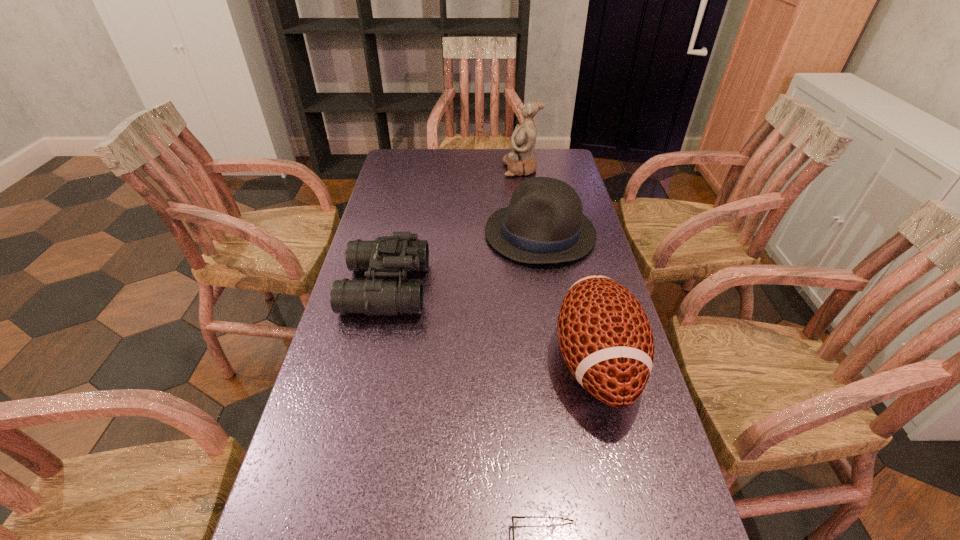
This screenshot has height=540, width=960. Identify the location of free space located on the front-facing side of the bowler hat. (385, 233).

You are a GUI agent. You are given a task and a screenshot of the screen. Output one action in this format:
    pyautogui.click(x=<x>, y=<y>)
    Task: Click on the free space located on the front-facing side of the bowler hat
    This screenshot has height=540, width=960.
    Given the screenshot: What is the action you would take?
    pyautogui.click(x=370, y=233)

The image size is (960, 540). What are the coordinates of `free point located through the lenses of the binoculars` in the screenshot? It's located at (566, 288).

At what (x,y) coordinates should I click in order to perform the action: click on object that is positioned at the far edge. Please return your answer as a coordinate pair (x, y). Looking at the image, I should click on (521, 160).

Where is `object that is at the left edge`? The image size is (960, 540). object that is at the left edge is located at coordinates (392, 256).

Where is `figurine present at the right edge`? figurine present at the right edge is located at coordinates (521, 160).

Where is `football at the right edge`? football at the right edge is located at coordinates (605, 336).

At what (x,y) coordinates should I click in order to perform the action: click on bowler hat situated at the right edge. Please return your answer as a coordinate pair (x, y). This screenshot has width=960, height=540. Looking at the image, I should click on (544, 223).

What are the coordinates of `object that is at the far right corner` in the screenshot? It's located at (521, 160).

The height and width of the screenshot is (540, 960). Find the location of `vacant space at the far edge of the desktop`. vacant space at the far edge of the desktop is located at coordinates (443, 165).